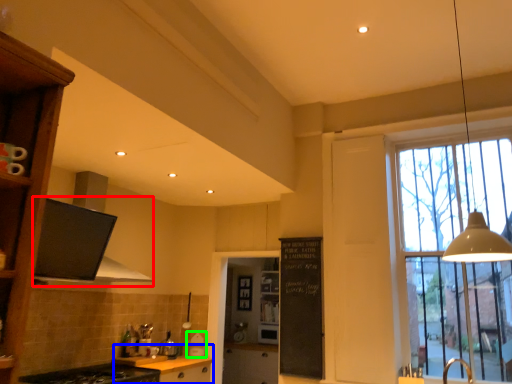
Question: Which is farther away from exhaust hood (highlighted by a red box)? cabinetry (highlighted by a blue box) or appliance (highlighted by a green box)?

Choices:
 (A) cabinetry
 (B) appliance

Answer: (B)